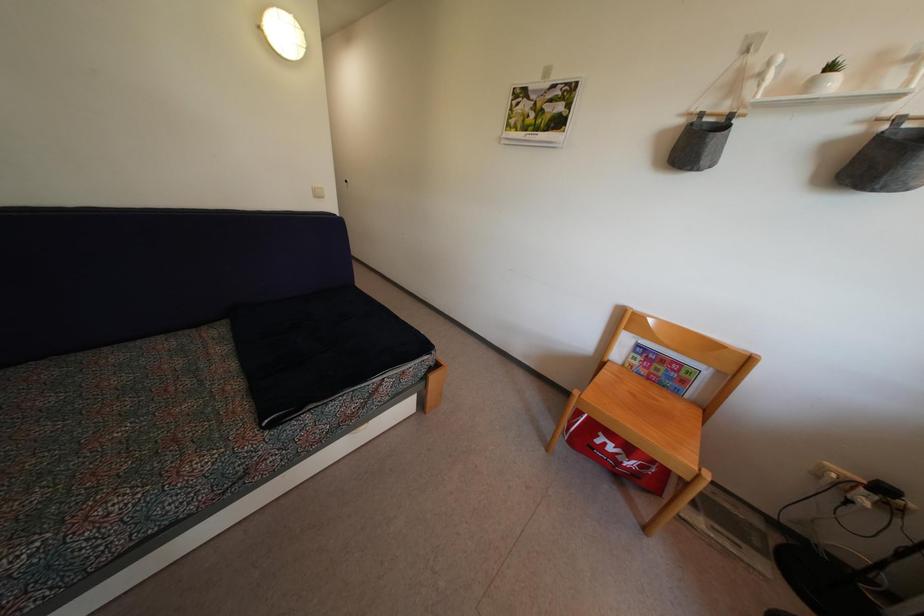
Locate an element on the screen. black folded blanket is located at coordinates (319, 349).